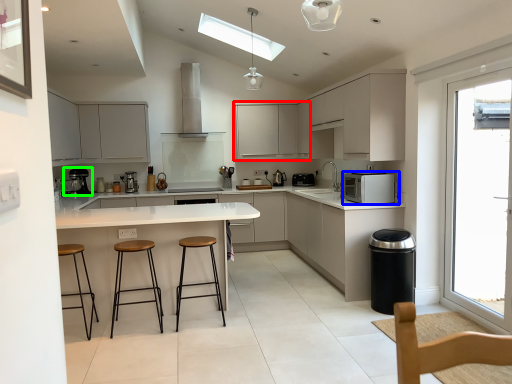
Question: Which is farther away from cabinetry (highlighted by a red box)? kitchen appliance (highlighted by a blue box) or coffee machine (highlighted by a green box)?

Choices:
 (A) kitchen appliance
 (B) coffee machine

Answer: (A)